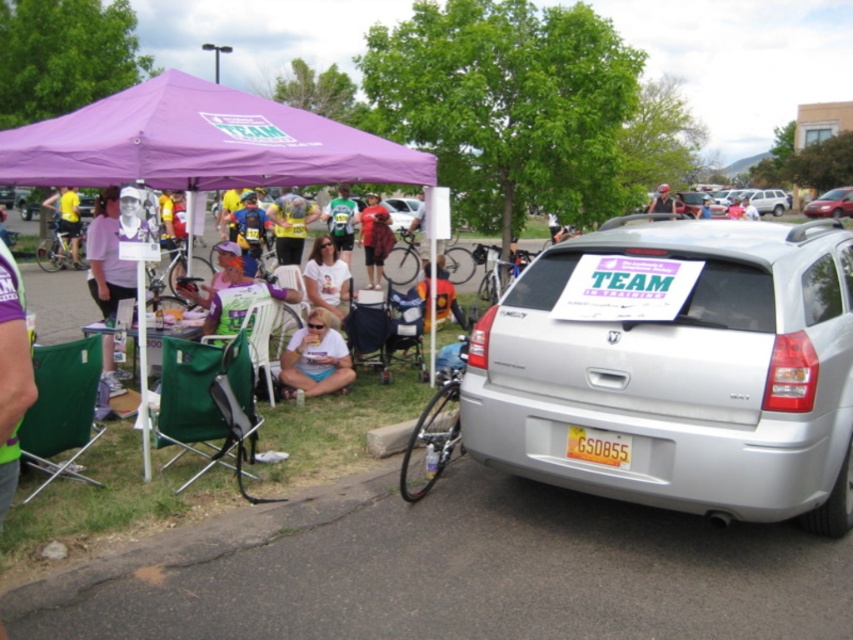
Question: Does purple fabric canopy at upper center have a larger size compared to orange fabric bag at center?

Choices:
 (A) yes
 (B) no

Answer: (A)

Question: Does white fabric shirt at center have a larger size compared to matte red shorts at center?

Choices:
 (A) yes
 (B) no

Answer: (B)

Question: Which point appears farthest from the camera in this image?

Choices:
 (A) (86, 164)
 (B) (108, 268)
 (C) (376, 252)
 (D) (663, 204)

Answer: (D)

Question: Which of the following is the farthest from the observer?

Choices:
 (A) (144, 474)
 (B) (453, 289)

Answer: (B)

Question: Estimate the real-world distances between objects in this image. Which object is farther from the purple fabric canopy at upper center?

Choices:
 (A) metallic red car at center
 (B) silver metallic car at right
 (C) silver metallic sedan at center
 (D) matte black helmet at upper center

Answer: (A)

Question: Is purple fabric canopy at upper center to the right of matte red shorts at center from the viewer's perspective?

Choices:
 (A) no
 (B) yes

Answer: (A)